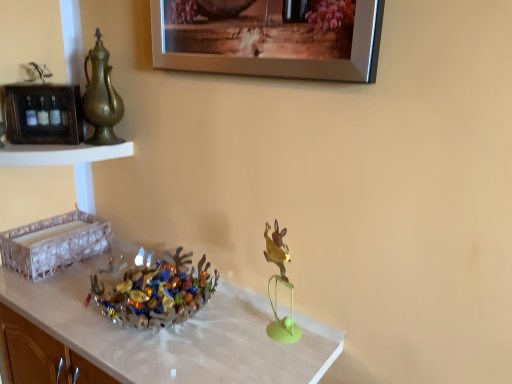
Where is `vacant area that lies in front of translucent glass tray at left, positioned as the first shelf in bottom-to-top order`? The width and height of the screenshot is (512, 384). vacant area that lies in front of translucent glass tray at left, positioned as the first shelf in bottom-to-top order is located at coordinates (48, 290).